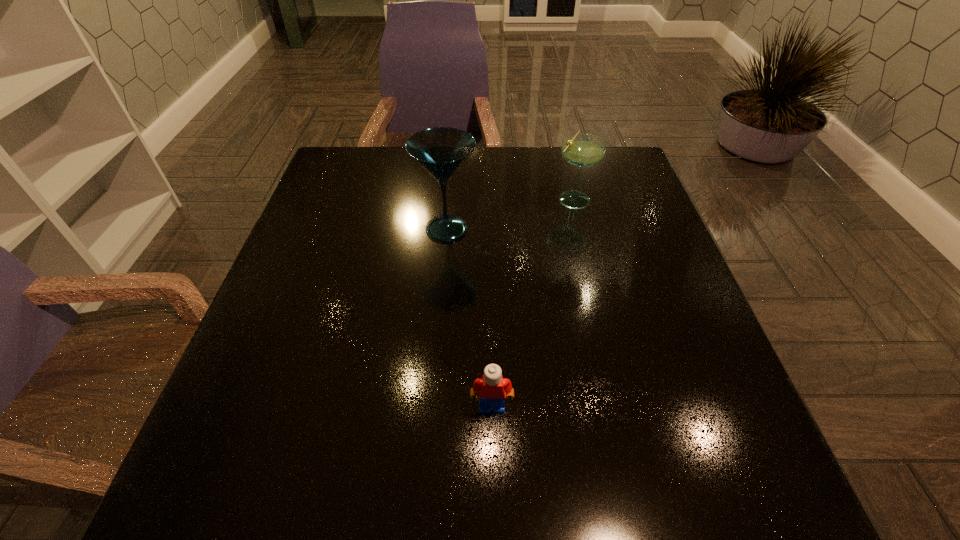
The height and width of the screenshot is (540, 960). I want to click on empty space that is in between the shorter martini and the nearest object, so click(x=533, y=302).

The height and width of the screenshot is (540, 960). I want to click on free space between the tallest object and the rightmost object, so click(x=510, y=213).

Where is `vacant area that lies between the second tallest object and the taller martini`? This screenshot has height=540, width=960. vacant area that lies between the second tallest object and the taller martini is located at coordinates (510, 213).

Identify the location of free area in between the tallest object and the shortest object. (469, 318).

Locate an element on the screen. vacant space that is in between the shortest object and the taller martini is located at coordinates (469, 318).

Locate an element on the screen. The height and width of the screenshot is (540, 960). vacant space that's between the left martini and the shorter martini is located at coordinates (510, 213).

At what (x,y) coordinates should I click in order to perform the action: click on empty location between the right martini and the Lego. Please return your answer as a coordinate pair (x, y). The height and width of the screenshot is (540, 960). Looking at the image, I should click on (533, 302).

Identify the location of free space between the nearest object and the taller martini. (469, 318).

Point out which object is positioned as the nearest to the nearest object. Please provide its 2D coordinates. Your answer should be formatted as a tuple, i.e. [(x, y)], where the tuple contains the x and y coordinates of a point satisfying the conditions above.

[(440, 150)]

Select which object is the closest to the left martini. Please provide its 2D coordinates. Your answer should be formatted as a tuple, i.e. [(x, y)], where the tuple contains the x and y coordinates of a point satisfying the conditions above.

[(583, 150)]